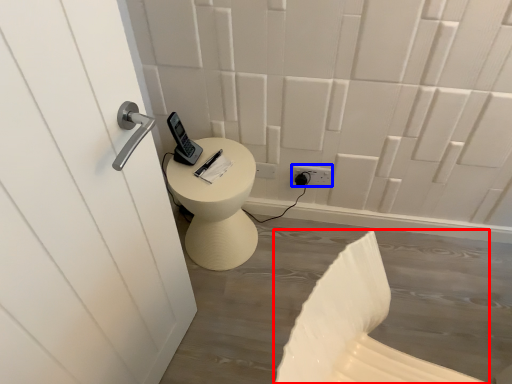
Question: Which object is closer to the camera taking this photo, swivel chair (highlighted by a red box) or electric outlet (highlighted by a blue box)?

Choices:
 (A) swivel chair
 (B) electric outlet

Answer: (A)